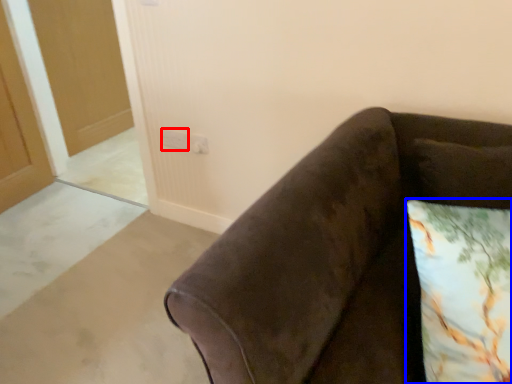
Question: Among these objects, which one is nearest to the camera, electric outlet (highlighted by a red box) or pillow (highlighted by a blue box)?

Choices:
 (A) electric outlet
 (B) pillow

Answer: (B)